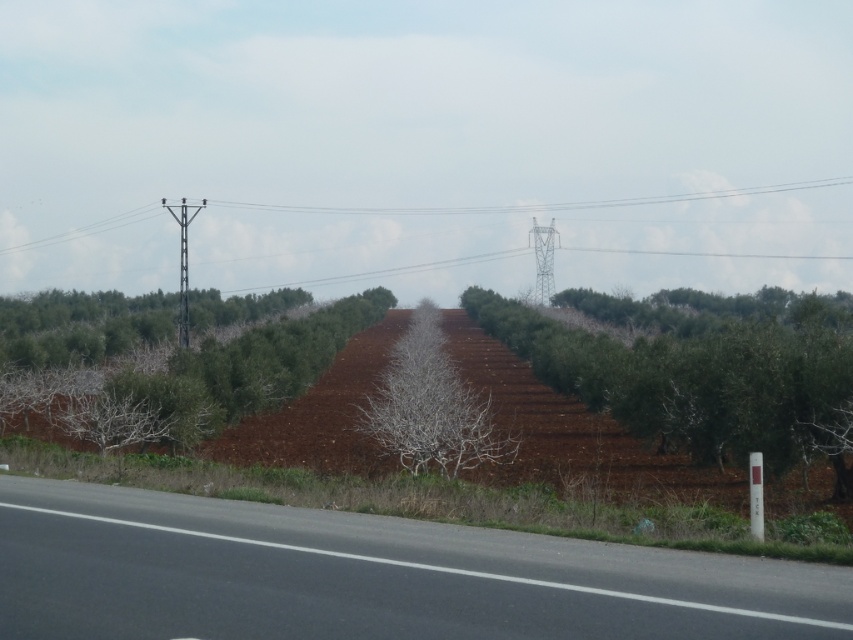
Question: Which object is farther from the camera taking this photo?

Choices:
 (A) metallic gray telegraph pole at center-right
 (B) green leafy tree at center
 (C) green leafy tree at left
 (D) metallic pole at center

Answer: (A)

Question: Does metallic pole at center appear on the right side of metallic gray telegraph pole at center-right?

Choices:
 (A) no
 (B) yes

Answer: (A)

Question: Which point is farther to the camera?

Choices:
 (A) metallic gray telegraph pole at center-right
 (B) black asphalt road at lower left

Answer: (A)

Question: Can you confirm if black asphalt road at lower left is smaller than white plastic pole at center?

Choices:
 (A) yes
 (B) no

Answer: (A)

Question: Which object appears farthest from the camera in this image?

Choices:
 (A) bare branches at center
 (B) white plastic pole at center

Answer: (A)

Question: In this image, where is green leafy tree at center located relative to metallic gray telegraph pole at center-right?

Choices:
 (A) below
 (B) above

Answer: (A)